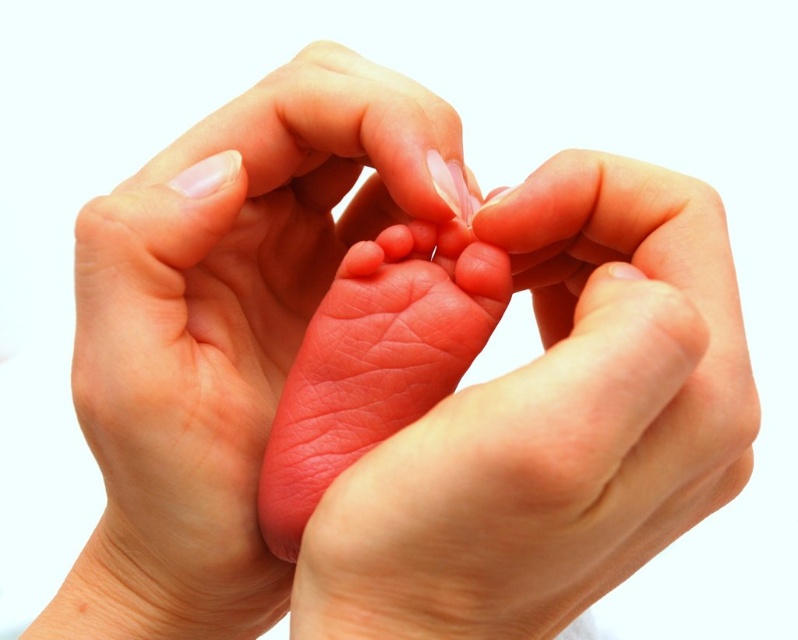
Based on the coordinates provided in the image description, where exactly is the smooth skin baby foot at center located?

The smooth skin baby foot at center is located at coordinates point [226,332].

You are a photographer adjusting lighting for a newborn photo shoot. You notice the pink smooth foot at center and the smooth pink toe at center. Which object is positioned closer to the camera lens?

The pink smooth foot at center is closer to the viewer than the smooth pink toe at center, so the pink smooth foot at center is positioned closer to the camera lens.